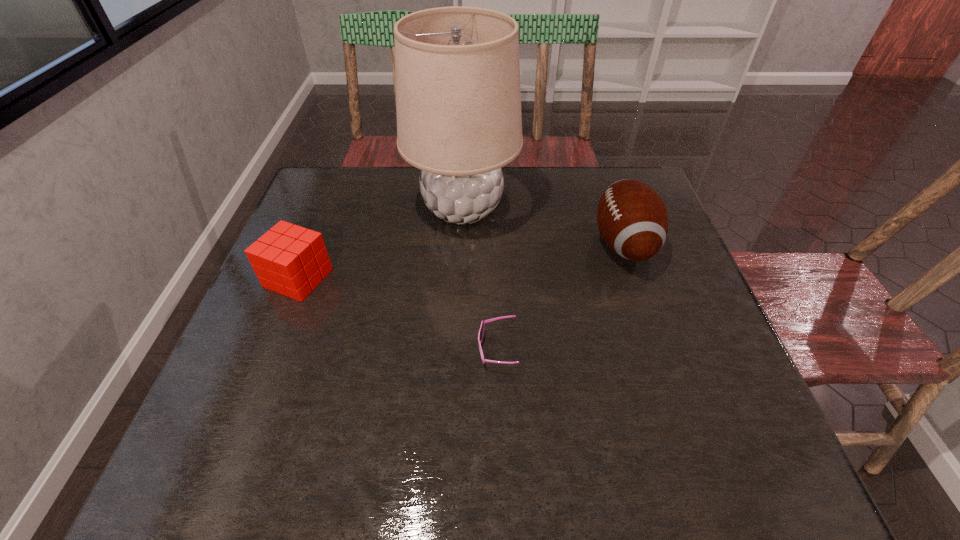
Where is `free spot between the third tallest object and the lampshade`? The height and width of the screenshot is (540, 960). free spot between the third tallest object and the lampshade is located at coordinates click(x=380, y=244).

Find the location of a particular element. This screenshot has height=540, width=960. empty location between the tallest object and the sunglasses is located at coordinates (480, 279).

Locate an element on the screen. Image resolution: width=960 pixels, height=540 pixels. vacant space in between the lampshade and the second shortest object is located at coordinates tap(380, 244).

Find the location of a particular element. This screenshot has width=960, height=540. free space that is in between the sunglasses and the tallest object is located at coordinates (480, 279).

The height and width of the screenshot is (540, 960). I want to click on the closest object to the lampshade, so click(289, 259).

This screenshot has width=960, height=540. Find the location of `object identified as the closest to the cube`. object identified as the closest to the cube is located at coordinates (458, 99).